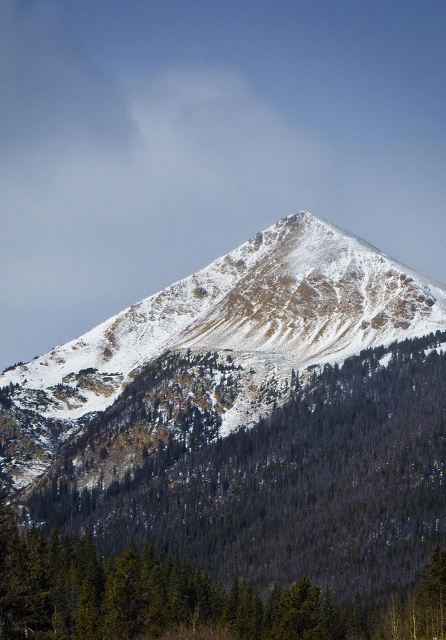
Does green textured tree at center appear on the right side of snowy rocky peak at center?

Incorrect, green textured tree at center is not on the right side of snowy rocky peak at center.

Who is more forward, (32,616) or (440,298)?

Positioned in front is point (32,616).

Identify the location of green textured tree at center. This screenshot has width=446, height=640. pos(243,512).